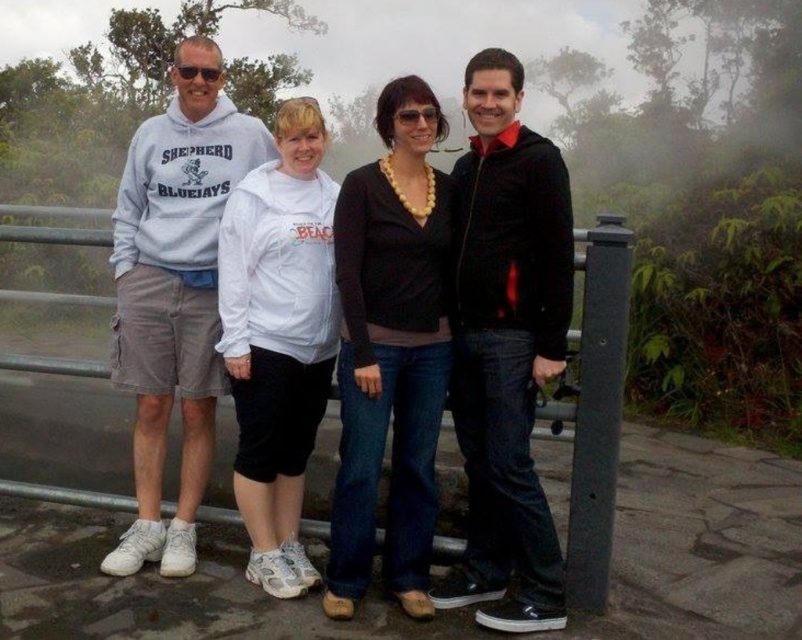
Between matte gray hoodie at left and gray cotton hoodie at left, which one is positioned lower?

Positioned lower is matte gray hoodie at left.

Does point (516, 253) come in front of point (196, 195)?

Yes, point (516, 253) is in front of point (196, 195).

In order to click on matte gray hoodie at left in this screenshot , I will do `click(452, 348)`.

Does matte black sweater at center have a lesser width compared to white fleece jacket at center?

Indeed, matte black sweater at center has a lesser width compared to white fleece jacket at center.

Is matte black sweater at center below white fleece jacket at center?

No, matte black sweater at center is not below white fleece jacket at center.

Is point (323, 595) closer to viewer compared to point (302, 284)?

Yes, point (323, 595) is closer to viewer.

Image resolution: width=802 pixels, height=640 pixels. What are the coordinates of `matte black sweater at center` in the screenshot? It's located at (391, 352).

Describe the element at coordinates (173, 292) in the screenshot. I see `gray cotton hoodie at left` at that location.

Is point (237, 164) more distant than point (235, 492)?

Yes, it is.

Which is behind, point (184, 268) or point (302, 488)?

Point (302, 488)

This screenshot has width=802, height=640. Find the location of `gray cotton hoodie at left`. gray cotton hoodie at left is located at coordinates (173, 292).